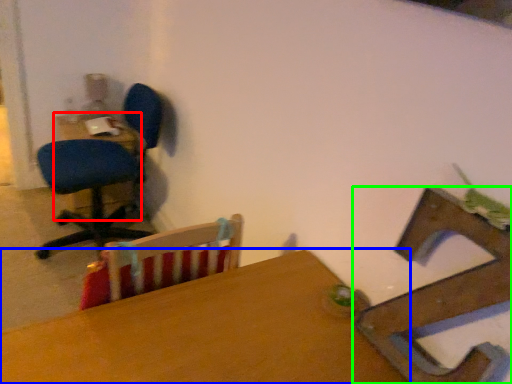
Question: Which is farther away from table (highlighted by a red box)? table (highlighted by a blue box) or chair (highlighted by a green box)?

Choices:
 (A) table
 (B) chair

Answer: (B)